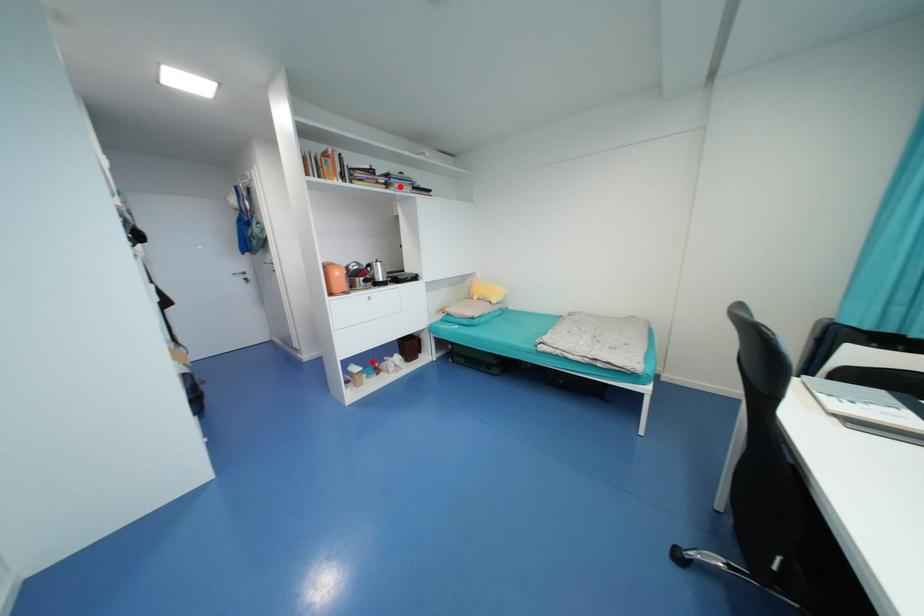
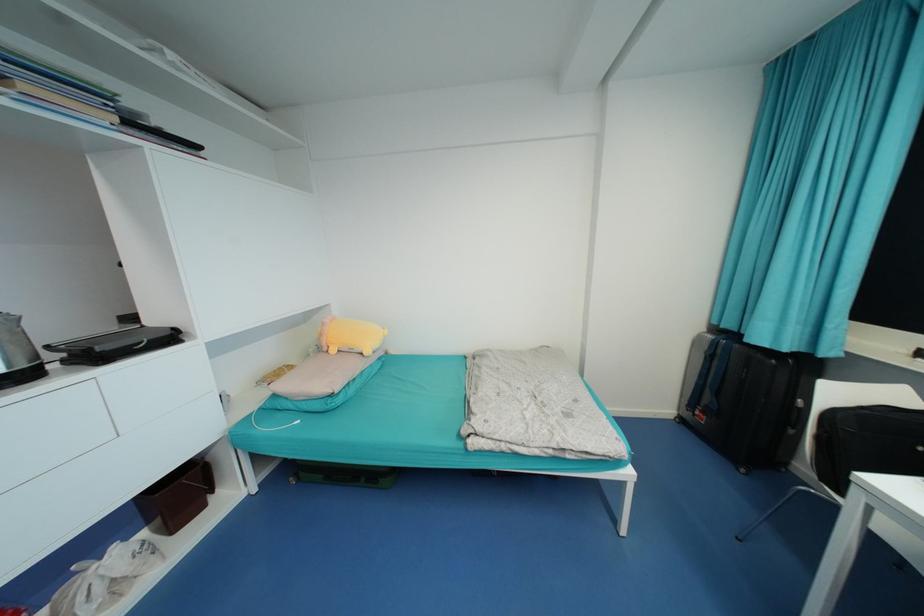
Question: I am providing you with two images of the same scene from different viewpoints. Given a red point in image1, look at the same physical point in image2. Is it:

Choices:
 (A) Closer to the viewpoint
 (B) Farther from the viewpoint

Answer: (B)